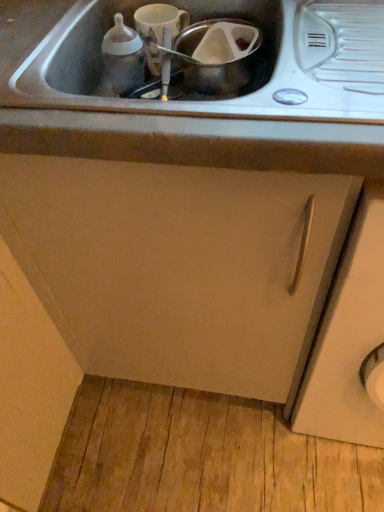
Image resolution: width=384 pixels, height=512 pixels. Identify the location of vacant area on top of metallic stainless steel sink at center, the second sink positioned from the front (from a real-world perspective). (170, 45).